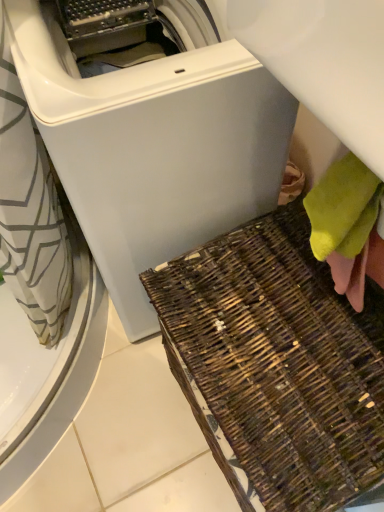
Question: From a real-world perspective, is soft yellow towel at lower right above or below brown woven basket at lower right?

Choices:
 (A) above
 (B) below

Answer: (A)

Question: Considering their positions, is soft yellow towel at lower right located in front of or behind brown woven basket at lower right?

Choices:
 (A) front
 (B) behind

Answer: (B)

Question: Which object is the farthest from the brown woven basket at lower right?

Choices:
 (A) white matte washing machine at center
 (B) soft yellow towel at lower right

Answer: (A)

Question: Which is nearer to the soft yellow towel at lower right?

Choices:
 (A) white matte washing machine at center
 (B) brown woven basket at lower right

Answer: (B)